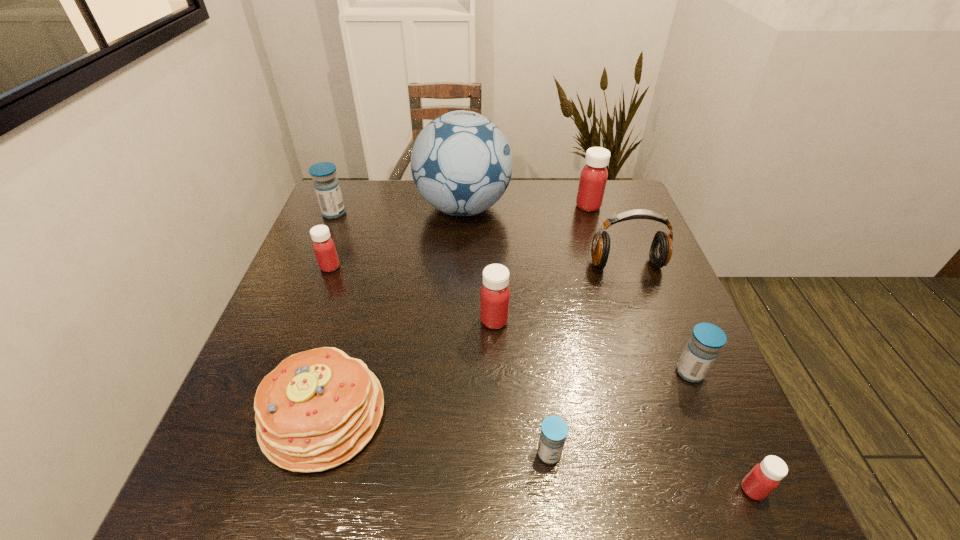
Locate an element on the screen. free region at the far left corner of the desktop is located at coordinates (351, 198).

Locate an element on the screen. The width and height of the screenshot is (960, 540). vacant space at the near left corner of the desktop is located at coordinates (221, 484).

What are the coordinates of `vacant point at the far right corner` in the screenshot? It's located at (623, 195).

Locate an element on the screen. The height and width of the screenshot is (540, 960). free space between the second smallest red medicine and the smallest red medicine is located at coordinates (541, 379).

Identify the location of free space between the smallest blue medicine and the nearest object. (651, 471).

At what (x,y) coordinates should I click in order to perform the action: click on unoccupied area between the third farthest medicine and the rightmost blue medicine. Please return your answer as a coordinate pair (x, y). The width and height of the screenshot is (960, 540). Looking at the image, I should click on (510, 320).

I want to click on free space between the leftmost blue medicine and the headset, so click(480, 239).

At what (x,y) coordinates should I click in order to perform the action: click on free space between the soccer ball and the headset. Please return your answer as a coordinate pair (x, y). Looking at the image, I should click on (544, 236).

Find the location of a particular element. The image size is (960, 540). vacant area that lies between the second farthest blue medicine and the leftmost blue medicine is located at coordinates (512, 293).

Where is `free spot between the tallest medicine and the second farthest blue medicine`? This screenshot has width=960, height=540. free spot between the tallest medicine and the second farthest blue medicine is located at coordinates (639, 289).